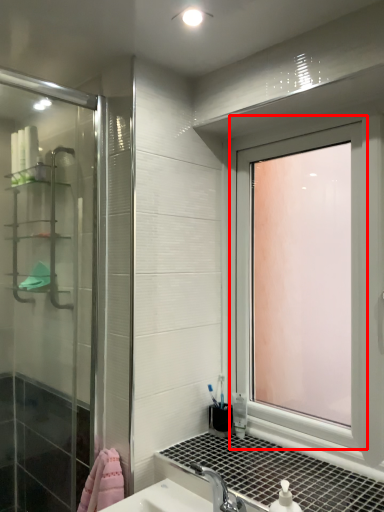
Question: Where is window (annotated by the red box) located in relation to shelf in the image?

Choices:
 (A) right
 (B) left

Answer: (A)